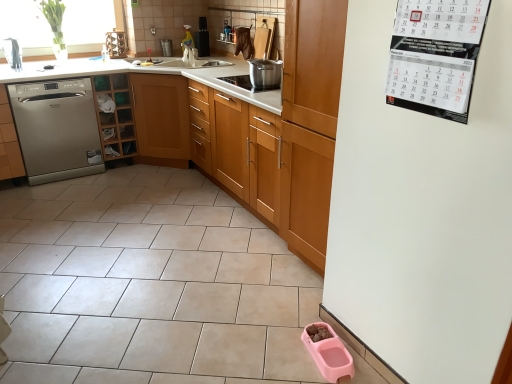
Question: Can you confirm if pink plastic pet food bowl at lower right is smaller than wooden cabinet at center, which is the third cabinetry in left-to-right order?

Choices:
 (A) yes
 (B) no

Answer: (A)

Question: Would you say pink plastic pet food bowl at lower right is a long distance from wooden cabinet at center, the 1th cabinetry positioned from the right?

Choices:
 (A) no
 (B) yes

Answer: (A)

Question: Is pink plastic pet food bowl at lower right thinner than wooden cabinet at center, the 1th cabinetry positioned from the right?

Choices:
 (A) yes
 (B) no

Answer: (A)

Question: Can wooden cabinet at center, which is the third cabinetry in left-to-right order, be found inside pink plastic pet food bowl at lower right?

Choices:
 (A) no
 (B) yes

Answer: (A)

Question: Is pink plastic pet food bowl at lower right shorter than wooden cabinet at center, the 1th cabinetry positioned from the right?

Choices:
 (A) yes
 (B) no

Answer: (A)

Question: Visually, is wooden cabinet at center, the 1th cabinetry positioned from the right, positioned to the left or to the right of wooden cabinet at left, the second cabinetry positioned from the right?

Choices:
 (A) right
 (B) left

Answer: (A)

Question: Considering the positions of wooden cabinet at center, the 1th cabinetry positioned from the right, and wooden cabinet at left, the second cabinetry positioned from the right, in the image, is wooden cabinet at center, the 1th cabinetry positioned from the right, wider or thinner than wooden cabinet at left, the second cabinetry positioned from the right,?

Choices:
 (A) thin
 (B) wide

Answer: (A)

Question: Considering the positions of point (347, 3) and point (118, 77), is point (347, 3) closer or farther from the camera than point (118, 77)?

Choices:
 (A) closer
 (B) farther

Answer: (A)

Question: From a real-world perspective, is wooden cabinet at center, the 1th cabinetry positioned from the right, physically located above or below wooden cabinet at left, the second cabinetry positioned from the right?

Choices:
 (A) below
 (B) above

Answer: (A)

Question: From the image's perspective, is satin silver dishwasher at left, placed as the first cabinetry when sorted from left to right, positioned above or below stainless steel pot at center?

Choices:
 (A) above
 (B) below

Answer: (B)

Question: Is satin silver dishwasher at left, placed as the first cabinetry when sorted from left to right, situated inside stainless steel pot at center or outside?

Choices:
 (A) outside
 (B) inside

Answer: (A)

Question: Based on their positions, is satin silver dishwasher at left, placed as the first cabinetry when sorted from left to right, located to the left or right of stainless steel pot at center?

Choices:
 (A) right
 (B) left

Answer: (B)

Question: Is point (4, 87) positioned closer to the camera than point (243, 81)?

Choices:
 (A) closer
 (B) farther

Answer: (B)

Question: Is white paper calendar at upper right taller or shorter than stainless steel pot at center?

Choices:
 (A) short
 (B) tall

Answer: (B)

Question: From the image's perspective, is white paper calendar at upper right located above or below stainless steel pot at center?

Choices:
 (A) below
 (B) above

Answer: (A)